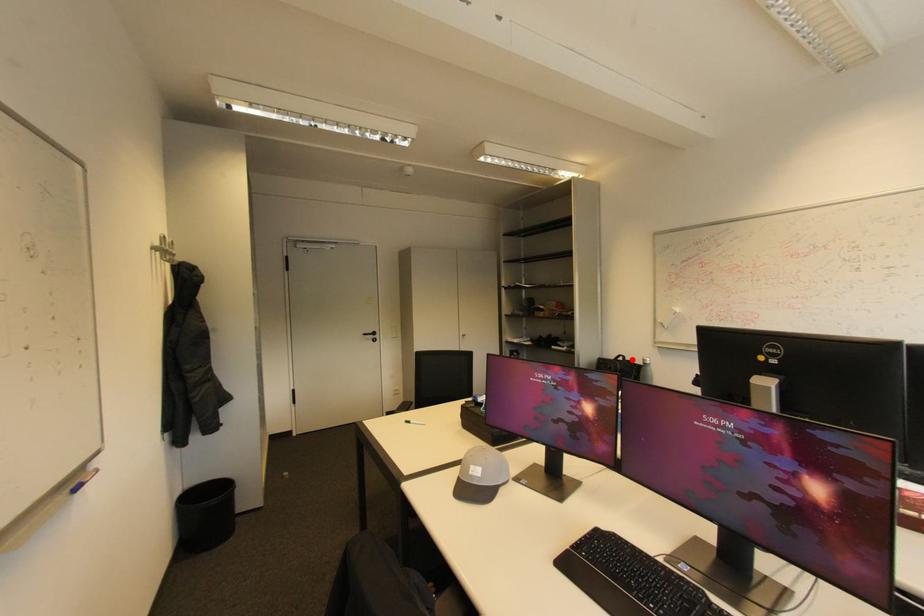
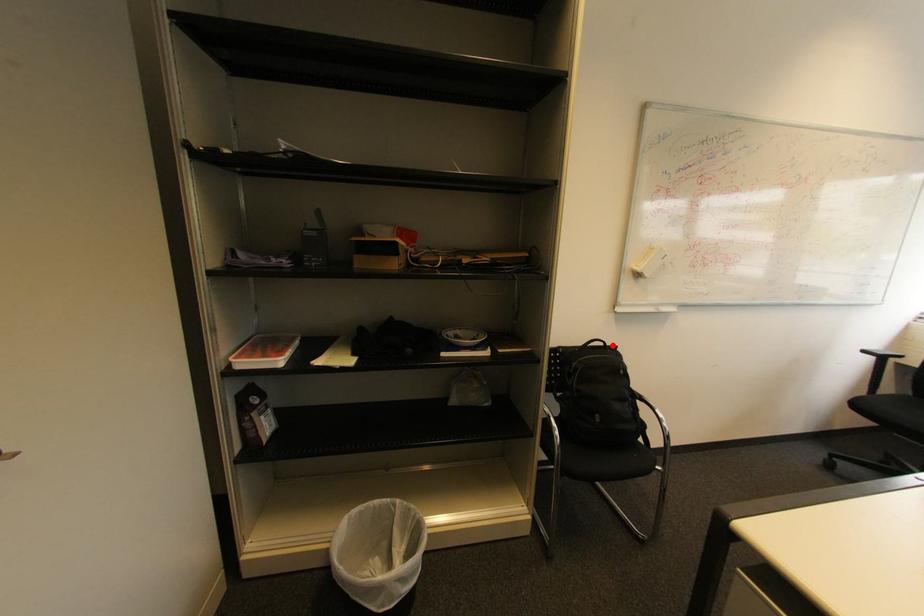
I am providing you with two images of the same scene from different viewpoints. A red point is marked on the first image and another point is marked on the second image. Is the marked point in image1 the same physical position as the marked point in image2?

Yes